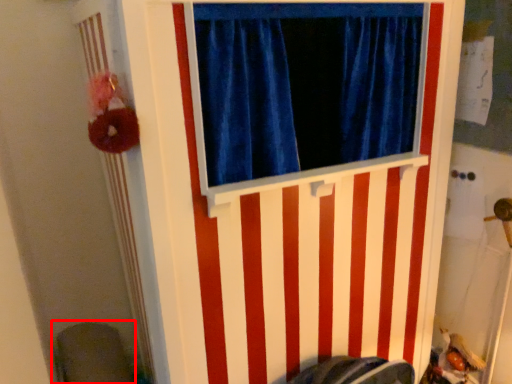
Question: Considering the relative positions of swivel chair (annotated by the red box) and barn door in the image provided, where is swivel chair (annotated by the red box) located with respect to the staircase?

Choices:
 (A) right
 (B) left

Answer: (B)